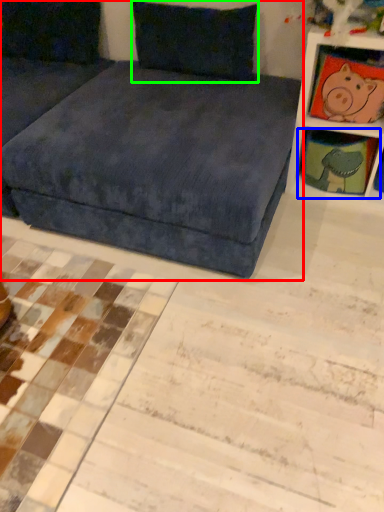
Question: Which is nearer to the studio couch (highlighted by a red box)? shelf (highlighted by a blue box) or pillow (highlighted by a green box).

Choices:
 (A) shelf
 (B) pillow

Answer: (B)